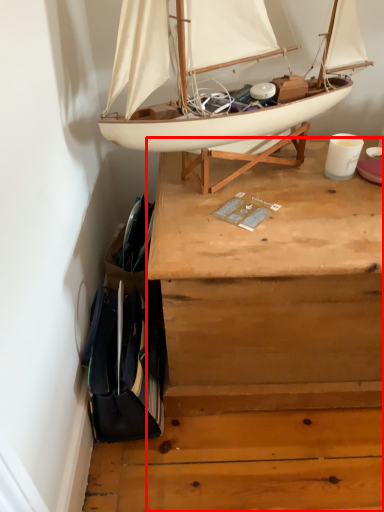
Question: From the image's perspective, what is the correct spatial positioning of desk (annotated by the red box) in reference to boat?

Choices:
 (A) above
 (B) below

Answer: (B)